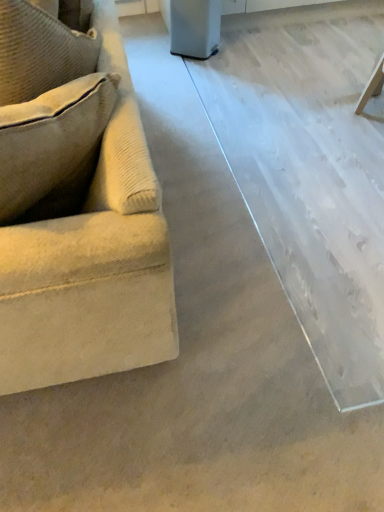
Find the location of `empty space that is to the right of beige corduroy couch at left`. empty space that is to the right of beige corduroy couch at left is located at coordinates (243, 196).